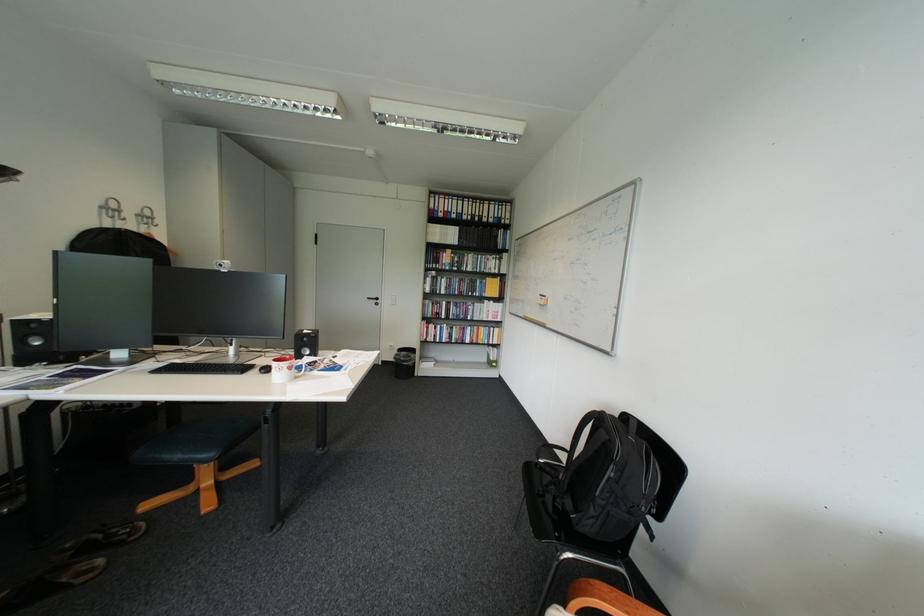
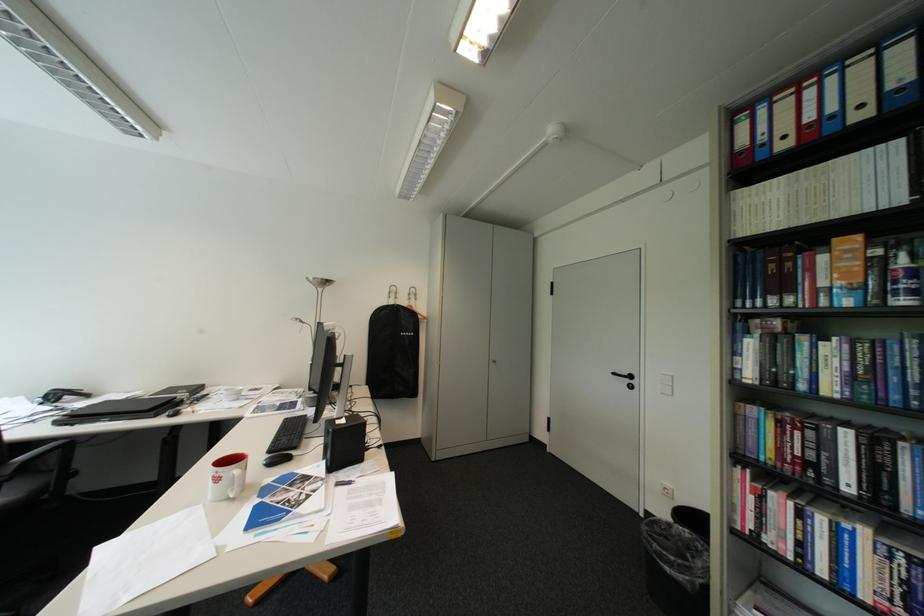
Find the pixel in the second image that matches [381,299] in the first image.

(626, 374)